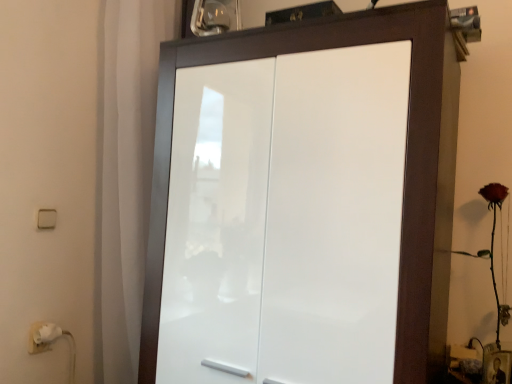
Question: Should I look upward or downward to see matte red rose at right?

Choices:
 (A) down
 (B) up

Answer: (A)

Question: Can you confirm if white matte curtain at left is taller than white plastic light switch at left?

Choices:
 (A) yes
 (B) no

Answer: (A)

Question: Would you say white matte curtain at left is a long distance from white plastic light switch at left?

Choices:
 (A) yes
 (B) no

Answer: (B)

Question: Are white matte curtain at left and white plastic light switch at left beside each other?

Choices:
 (A) yes
 (B) no

Answer: (B)

Question: Is white matte curtain at left outside of white plastic light switch at left?

Choices:
 (A) yes
 (B) no

Answer: (A)

Question: Is white plastic light switch at left completely or partially inside white matte curtain at left?

Choices:
 (A) no
 (B) yes

Answer: (A)

Question: Is white matte curtain at left facing towards white plastic light switch at left?

Choices:
 (A) yes
 (B) no

Answer: (B)

Question: Considering the relative sizes of white glossy cupboard at center and matte red rose at right in the image provided, is white glossy cupboard at center taller than matte red rose at right?

Choices:
 (A) no
 (B) yes

Answer: (B)

Question: Is white glossy cupboard at center further to the viewer compared to matte red rose at right?

Choices:
 (A) no
 (B) yes

Answer: (A)

Question: Can matte red rose at right be found inside white glossy cupboard at center?

Choices:
 (A) yes
 (B) no

Answer: (B)

Question: Is white glossy cupboard at center bigger than matte red rose at right?

Choices:
 (A) yes
 (B) no

Answer: (A)

Question: Does white glossy cupboard at center have a lesser width compared to matte red rose at right?

Choices:
 (A) yes
 (B) no

Answer: (B)

Question: Are white glossy cupboard at center and matte red rose at right located far from each other?

Choices:
 (A) no
 (B) yes

Answer: (A)

Question: Does white glossy cupboard at center have a smaller size compared to white plastic light switch at left?

Choices:
 (A) yes
 (B) no

Answer: (B)